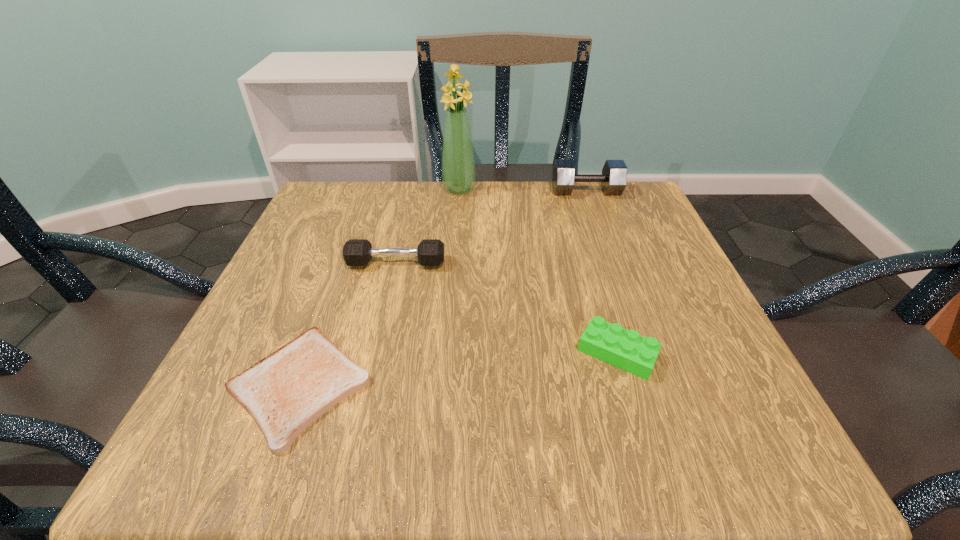
Locate an element on the screen. vacant area that satisfies the following two spatial constraints: 1. on the back side of the second shortest object; 2. on the left side of the shortest object is located at coordinates (311, 353).

Identify the location of free spot that satisfies the following two spatial constraints: 1. on the back side of the fourth tallest object; 2. on the left side of the shortest object. (311, 353).

Locate an element on the screen. This screenshot has width=960, height=540. free point that satisfies the following two spatial constraints: 1. on the front-facing side of the tallest object; 2. on the right side of the second tallest object is located at coordinates (459, 191).

The height and width of the screenshot is (540, 960). In order to click on blank area in the image that satisfies the following two spatial constraints: 1. on the front-facing side of the tallest object; 2. on the right side of the second tallest object in this screenshot , I will do `click(459, 191)`.